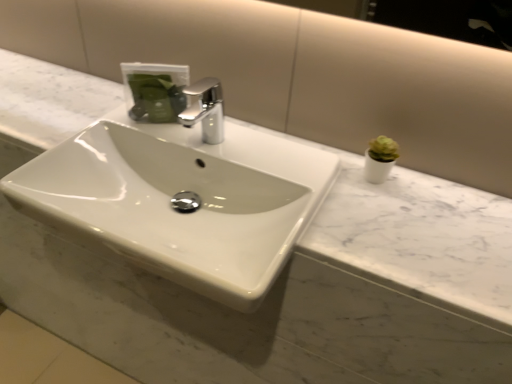
Where is `free location to the left of chrome metallic faucet at center`? The width and height of the screenshot is (512, 384). free location to the left of chrome metallic faucet at center is located at coordinates (153, 127).